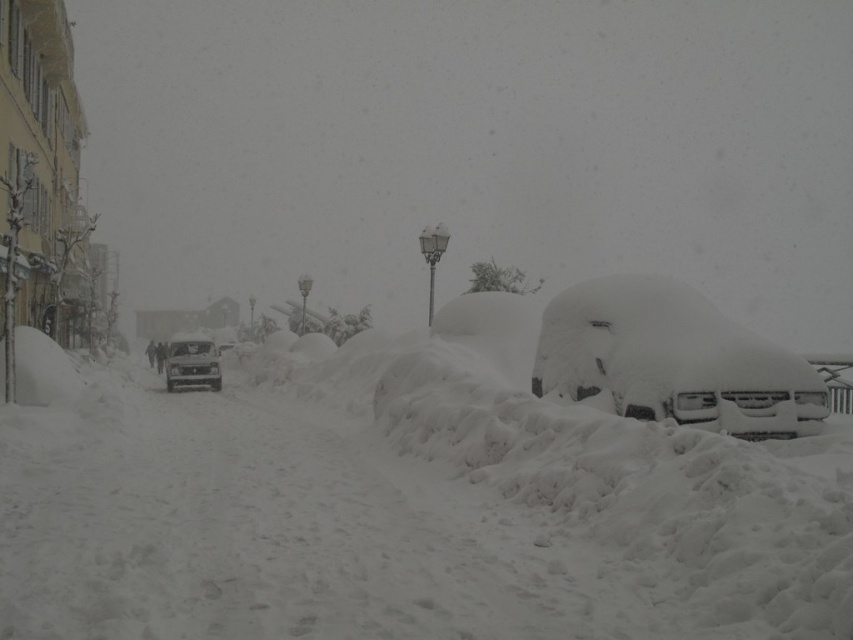
Question: Which of the following is the closest to the observer?

Choices:
 (A) (167, 385)
 (B) (624, 381)
 (C) (625, 440)

Answer: (C)

Question: Does white fluffy snow at center have a larger size compared to white fluffy car at center?

Choices:
 (A) yes
 (B) no

Answer: (A)

Question: Among these points, which one is farthest from the camera?

Choices:
 (A) (753, 624)
 (B) (198, 355)

Answer: (B)

Question: Is white fluffy snow at center thinner than shiny silver car at center?

Choices:
 (A) no
 (B) yes

Answer: (A)

Question: Which of the following is the closest to the observer?

Choices:
 (A) white fluffy snow at center
 (B) shiny silver car at center
 (C) white fluffy car at center

Answer: (A)

Question: Can you confirm if white fluffy snow at center is wider than white fluffy car at center?

Choices:
 (A) yes
 (B) no

Answer: (A)